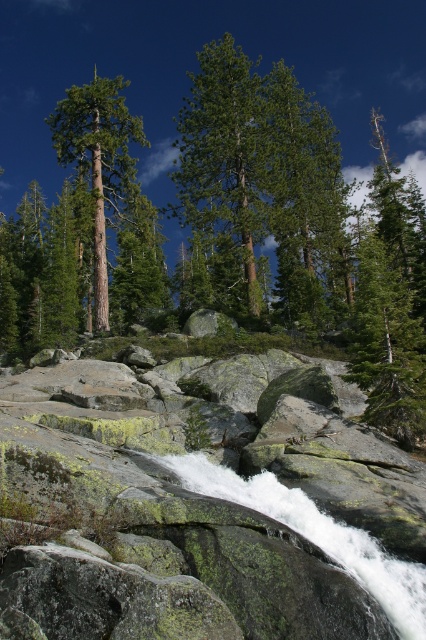
Does green mossy rock at center come behind green matte tree at left?

No, it is not.

Does point (74, 376) lie behind point (123, 122)?

No.

You are a GUI agent. You are given a task and a screenshot of the screen. Output one action in this format:
    pyautogui.click(x=<x>, y=<y>)
    Task: Click on the green mossy rock at center
    
    Given the screenshot: What is the action you would take?
    pyautogui.click(x=164, y=525)